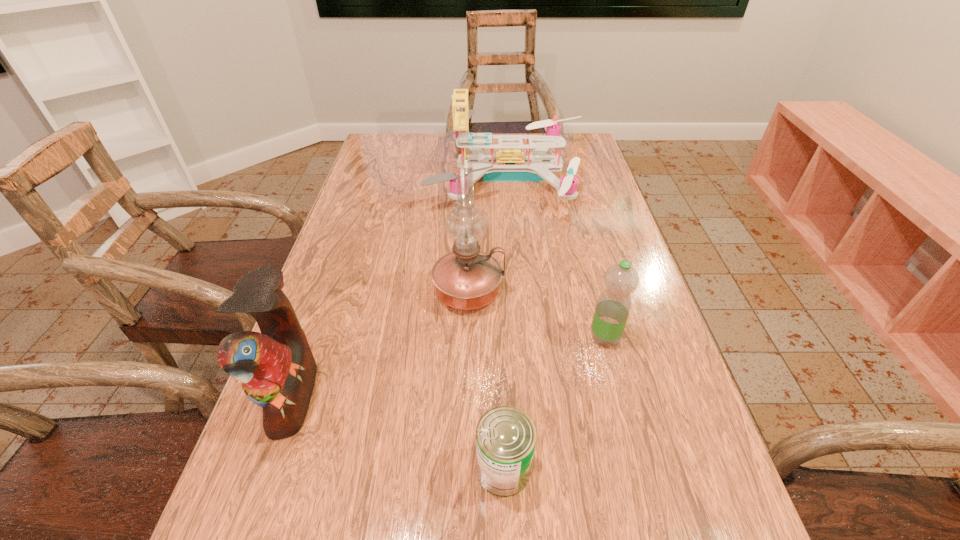
Locate an element on the screen. vacant position at the left edge of the desktop is located at coordinates (399, 217).

Where is `vacant space at the right edge of the desktop`? vacant space at the right edge of the desktop is located at coordinates (689, 408).

The width and height of the screenshot is (960, 540). In the image, there is a desktop. Find the location of `free region at the far left corner`. free region at the far left corner is located at coordinates (391, 164).

The image size is (960, 540). Find the location of `free area in between the shortest object and the leftmost object`. free area in between the shortest object and the leftmost object is located at coordinates (398, 433).

Locate an element on the screen. The image size is (960, 540). free space between the farthest object and the oil lamp is located at coordinates (489, 234).

This screenshot has height=540, width=960. In order to click on free space between the second farthest object and the farthest object in this screenshot , I will do `click(489, 234)`.

Locate an element on the screen. vacant space that is in between the parrot and the oil lamp is located at coordinates (380, 344).

You are a GUI agent. You are given a task and a screenshot of the screen. Output one action in this format:
    pyautogui.click(x=<x>, y=<y>)
    Task: Click on the vacant space that's between the water bottle and the can
    The height and width of the screenshot is (540, 960).
    Given the screenshot: What is the action you would take?
    pyautogui.click(x=554, y=403)

Find the location of a particular element. empty space between the oil lamp and the drone is located at coordinates (489, 234).

What are the coordinates of `free space between the drone and the shortest object` in the screenshot? It's located at click(506, 323).